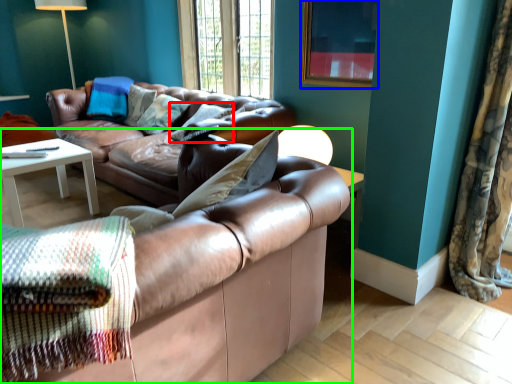
Question: Which object is the farthest from pillow (highlighted by a red box)? Choose among these: picture frame (highlighted by a blue box) or studio couch (highlighted by a green box).

Choices:
 (A) picture frame
 (B) studio couch

Answer: (B)